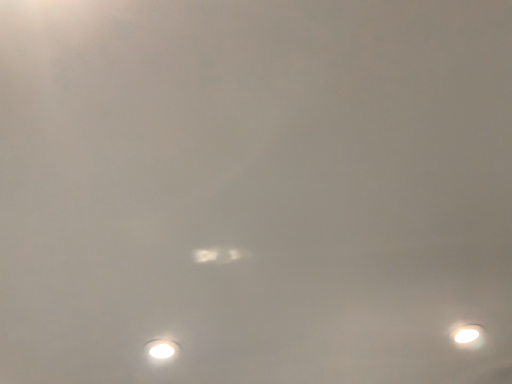
The image size is (512, 384). Describe the element at coordinates (468, 334) in the screenshot. I see `white glossy lamp at lower right` at that location.

Identify the location of white glossy lamp at lower right. This screenshot has height=384, width=512. (468, 334).

Locate an element on the screen. The image size is (512, 384). white glossy lamp at lower right is located at coordinates (468, 334).